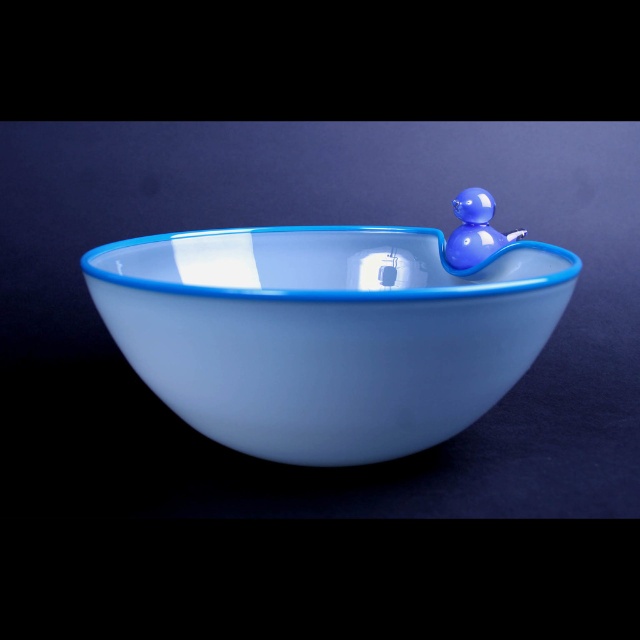
You are arranging items on a shelf and need to place the matte glass bowl at center and the glossy plastic duck at upper right. Based on their positions in the image, which object is higher up?

The glossy plastic duck at upper right is higher up than the matte glass bowl at center.

You are an interior designer arranging a modern living room. You have a matte glass bowl at center and a glossy plastic duck at upper right. Which object would you place in a spot that requires a larger footprint to accommodate its size?

The matte glass bowl at center is larger in size than the glossy plastic duck at upper right, so it should be placed in a spot that requires a larger footprint to accommodate its size.